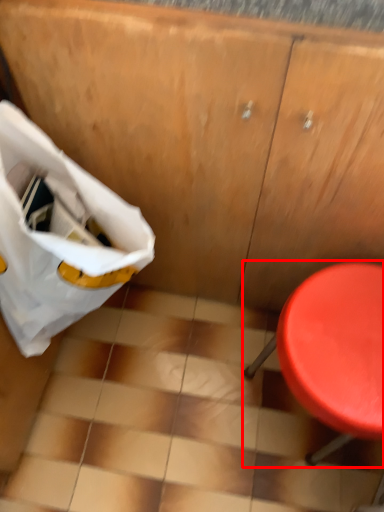
Question: From the image's perspective, where is furniture (annotated by the red box) located relative to grocery bag?

Choices:
 (A) above
 (B) below

Answer: (B)